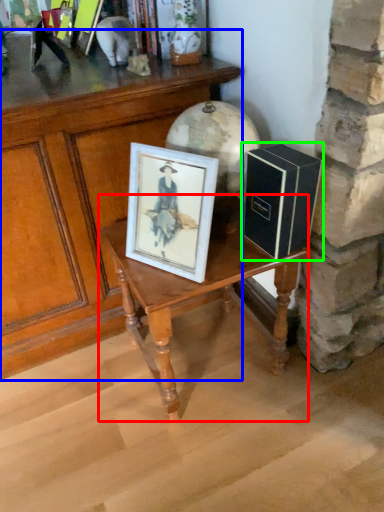
Question: Which object is positioned closest to table (highlighted by a red box)? Select from table (highlighted by a blue box) and book (highlighted by a green box).

Choices:
 (A) table
 (B) book

Answer: (B)